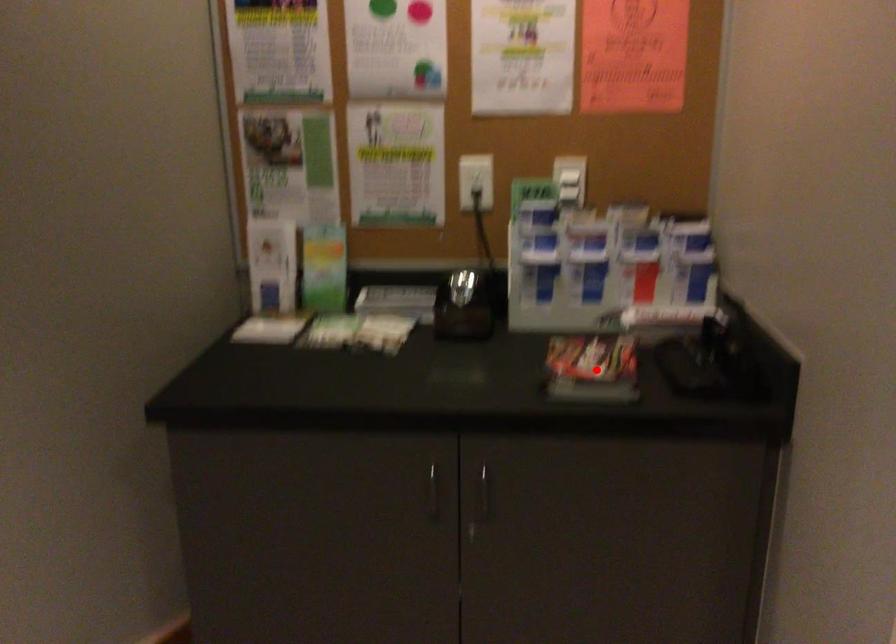
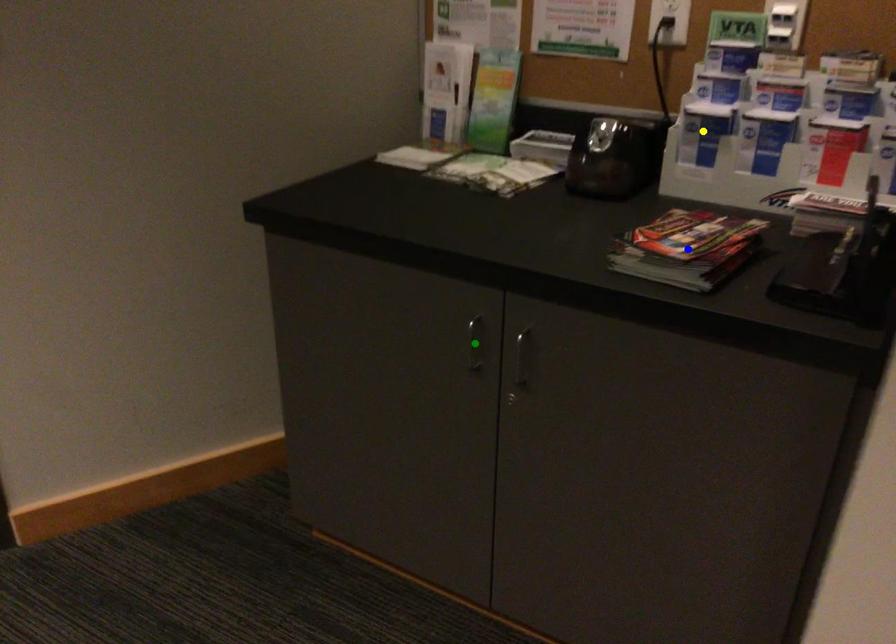
Question: I am providing you with two images of the same scene from different viewpoints. A red point is marked on the first image. You are given multiple points on the second image. Which point in image 2 is actually the same real-world point as the red point in image 1?

Choices:
 (A) green point
 (B) yellow point
 (C) blue point

Answer: (C)